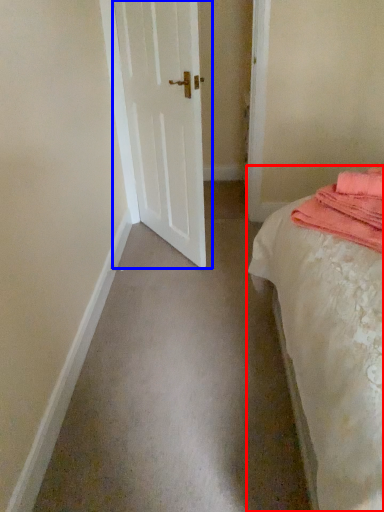
Question: Which object is closer to the camera taking this photo, bed (highlighted by a red box) or door (highlighted by a blue box)?

Choices:
 (A) bed
 (B) door

Answer: (A)